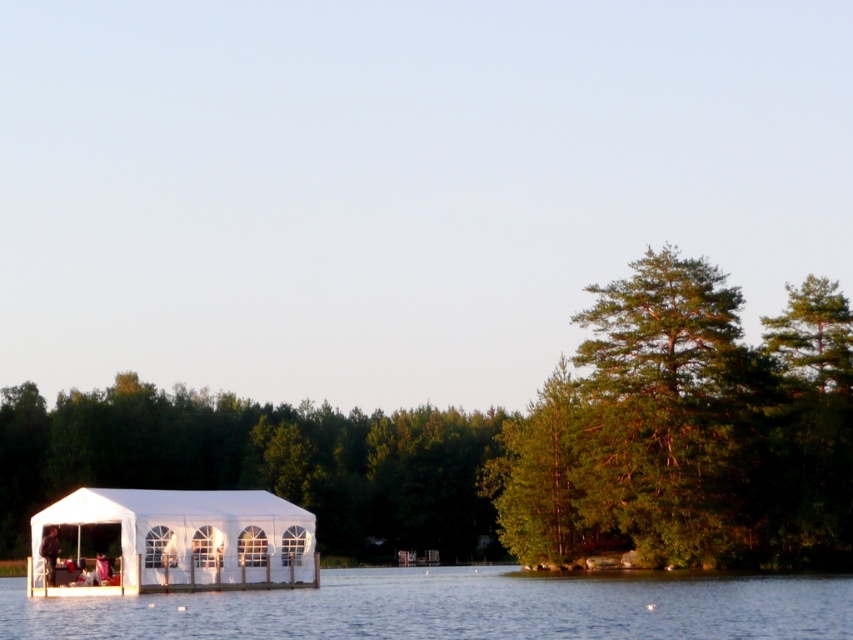
Question: Is transparent water at center smaller than white fabric tent at lower left?

Choices:
 (A) yes
 (B) no

Answer: (B)

Question: Is green leafy tree at right below white fabric tent at lower left?

Choices:
 (A) no
 (B) yes

Answer: (A)

Question: Which point is closer to the camera?

Choices:
 (A) white fabric tent at lower left
 (B) transparent water at center
 (C) green leafy tree at center

Answer: (B)

Question: Which of the following is the farthest from the observer?

Choices:
 (A) (78, 580)
 (B) (819, 348)
 (C) (683, 589)
 (D) (161, 440)

Answer: (D)

Question: Which point is farther to the camera?

Choices:
 (A) white fabric tent at lower center
 (B) green leafy tree at right

Answer: (B)

Question: Can you confirm if green leafy tree at right is positioned below transparent water at center?

Choices:
 (A) no
 (B) yes

Answer: (A)